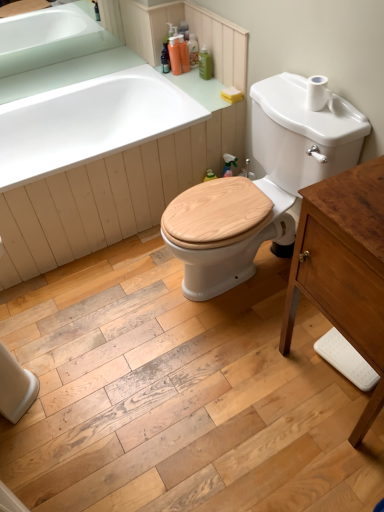
Question: Could you tell me if orange plastic bottles at upper center, the fourth toiletry viewed from the right, is turned towards white matte toilet paper at upper right?

Choices:
 (A) yes
 (B) no

Answer: (B)

Question: Is orange plastic bottles at upper center, placed as the first toiletry when sorted from left to right, not close to white matte toilet paper at upper right?

Choices:
 (A) yes
 (B) no

Answer: (A)

Question: From the image's perspective, is orange plastic bottles at upper center, the fourth toiletry viewed from the right, on top of white matte toilet paper at upper right?

Choices:
 (A) no
 (B) yes

Answer: (B)

Question: Does orange plastic bottles at upper center, the fourth toiletry viewed from the right, have a greater height compared to white matte toilet paper at upper right?

Choices:
 (A) no
 (B) yes

Answer: (B)

Question: From the image's perspective, is orange plastic bottles at upper center, placed as the first toiletry when sorted from left to right, located beneath white matte toilet paper at upper right?

Choices:
 (A) yes
 (B) no

Answer: (B)

Question: Looking at their shapes, would you say white glossy sink at upper left is wider or thinner than translucent plastic soap dispenser at upper center, marked as the 3th toiletry in a right-to-left arrangement?

Choices:
 (A) wide
 (B) thin

Answer: (B)

Question: Is point (87, 52) closer or farther from the camera than point (188, 65)?

Choices:
 (A) closer
 (B) farther

Answer: (B)

Question: Looking at the image, does white glossy sink at upper left seem bigger or smaller compared to translucent plastic soap dispenser at upper center, marked as the 3th toiletry in a right-to-left arrangement?

Choices:
 (A) small
 (B) big

Answer: (B)

Question: Considering the positions of white glossy sink at upper left and translucent plastic soap dispenser at upper center, marked as the 3th toiletry in a right-to-left arrangement, in the image, is white glossy sink at upper left taller or shorter than translucent plastic soap dispenser at upper center, marked as the 3th toiletry in a right-to-left arrangement,?

Choices:
 (A) short
 (B) tall

Answer: (B)

Question: Is wooden at center situated inside green matte bottle at upper center, the 4th toiletry from the left, or outside?

Choices:
 (A) inside
 (B) outside

Answer: (B)

Question: From their relative heights in the image, would you say wooden at center is taller or shorter than green matte bottle at upper center, the first toiletry in the right-to-left sequence?

Choices:
 (A) short
 (B) tall

Answer: (B)

Question: From the image's perspective, relative to green matte bottle at upper center, the 4th toiletry from the left, is wooden at center above or below?

Choices:
 (A) above
 (B) below

Answer: (B)

Question: Does point (276, 122) appear closer or farther from the camera than point (201, 46)?

Choices:
 (A) closer
 (B) farther

Answer: (A)

Question: Relative to white glossy sink at upper left, is translucent plastic soap at upper center, which is the second toiletry from right to left, in front or behind?

Choices:
 (A) behind
 (B) front

Answer: (A)

Question: Considering the relative positions of translucent plastic soap at upper center, which is the second toiletry from right to left, and white glossy sink at upper left in the image provided, is translucent plastic soap at upper center, which is the second toiletry from right to left, to the left or to the right of white glossy sink at upper left?

Choices:
 (A) left
 (B) right

Answer: (B)